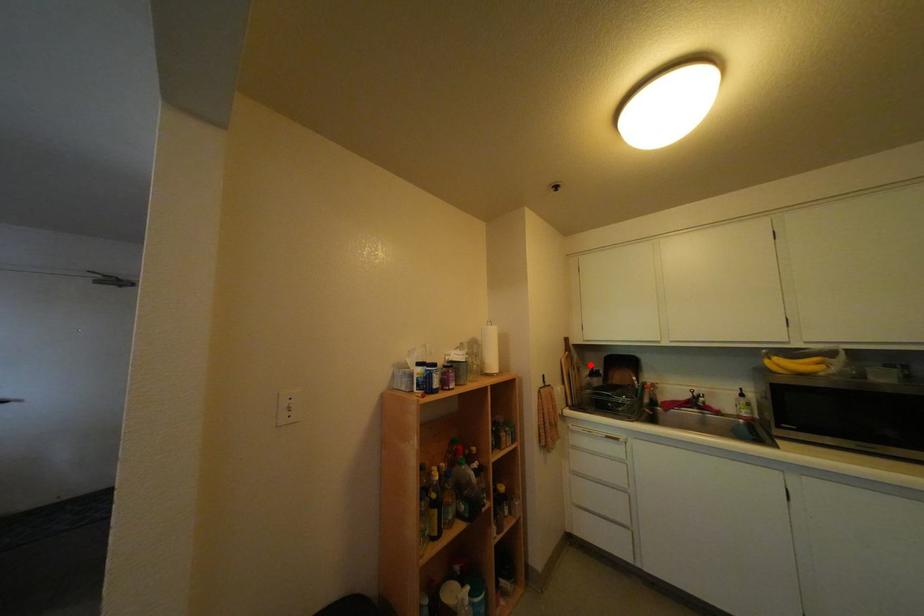
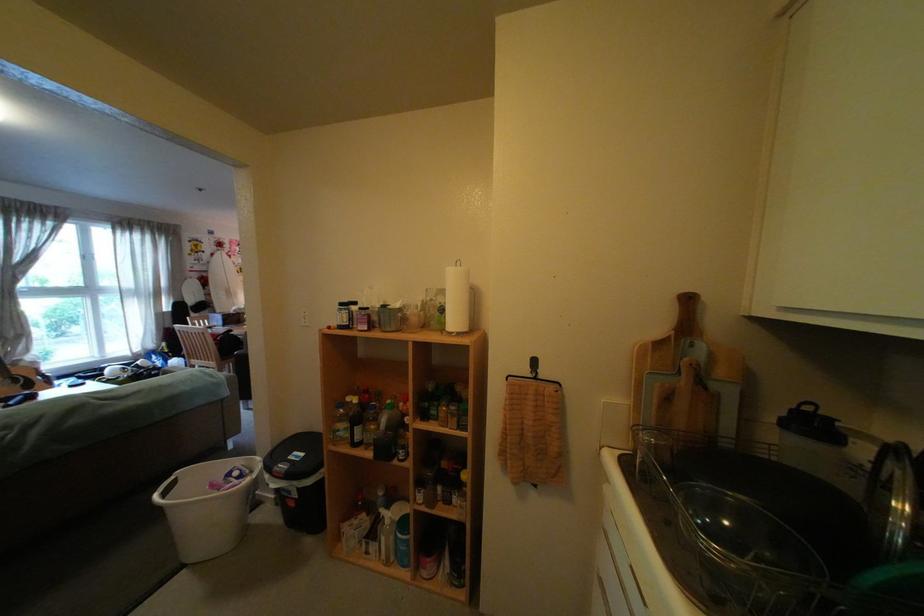
Locate, in the second image, the point that corresponds to the highlighted location in the first image.

(704, 367)